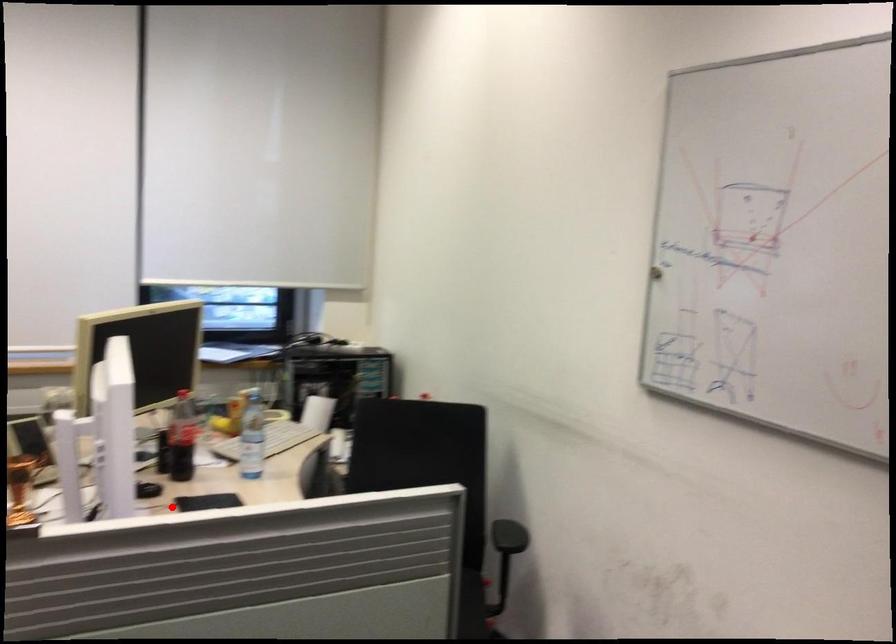
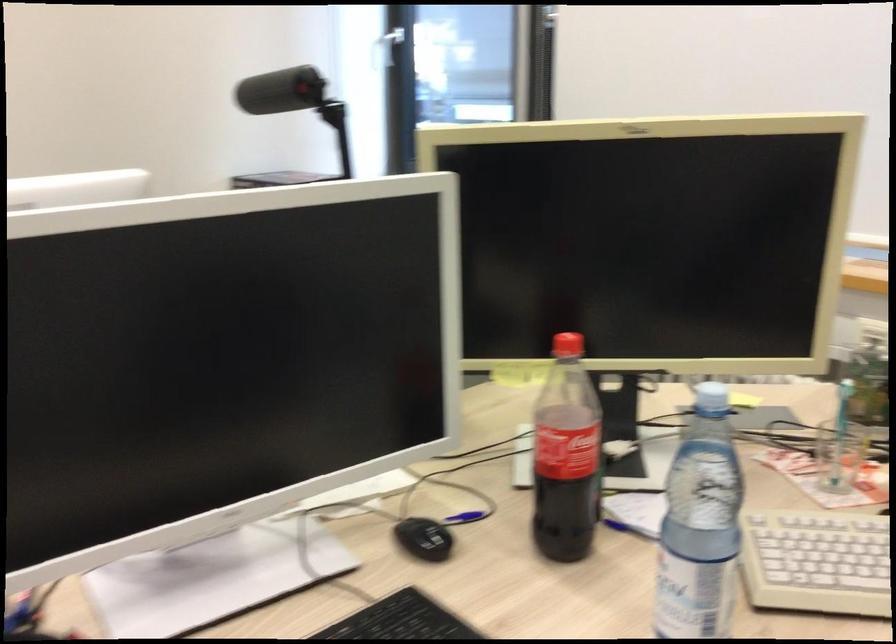
Question: A red point is marked in image1. In image2, is the corresponding 3D point closer to the camera or farther? Reply with the corresponding letter.

Choices:
 (A) The corresponding 3D point is closer.
 (B) The corresponding 3D point is farther.

Answer: (A)